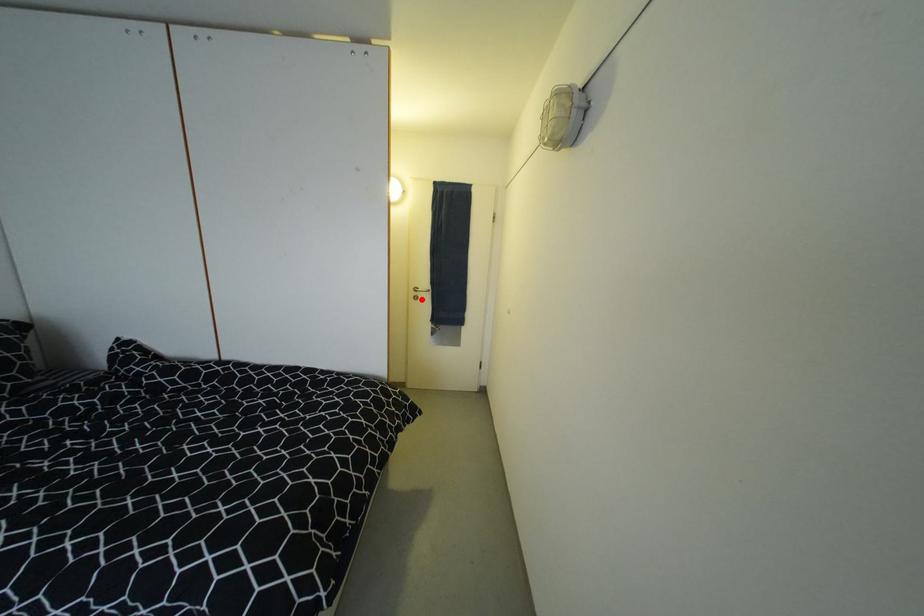
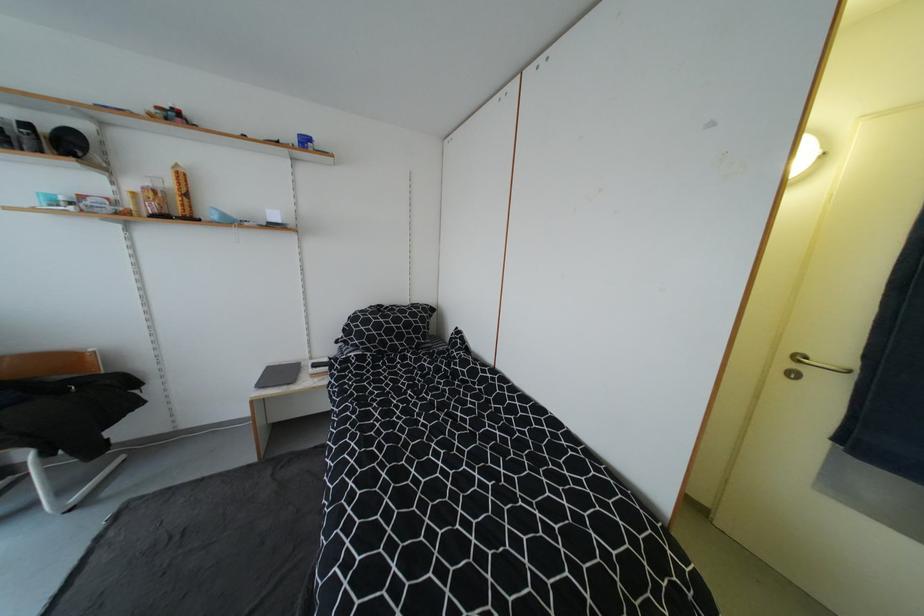
Question: I am providing you with two images of the same scene from different viewpoints. Given a red point in image1, look at the same physical point in image2. Is it:

Choices:
 (A) Closer to the viewpoint
 (B) Farther from the viewpoint

Answer: (B)